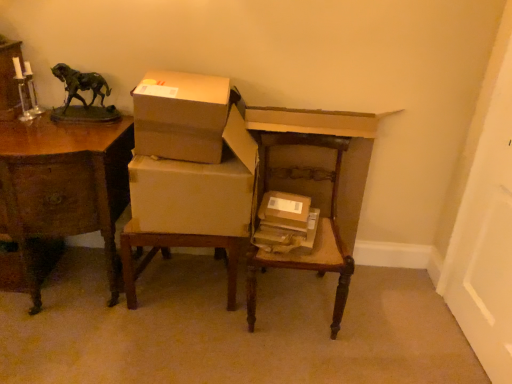
Locate an element on the screen. This screenshot has width=512, height=384. vacant area on top of brown cardboard box at center, which appears as the 2th box when viewed from the left (from a real-world perspective) is located at coordinates (291, 209).